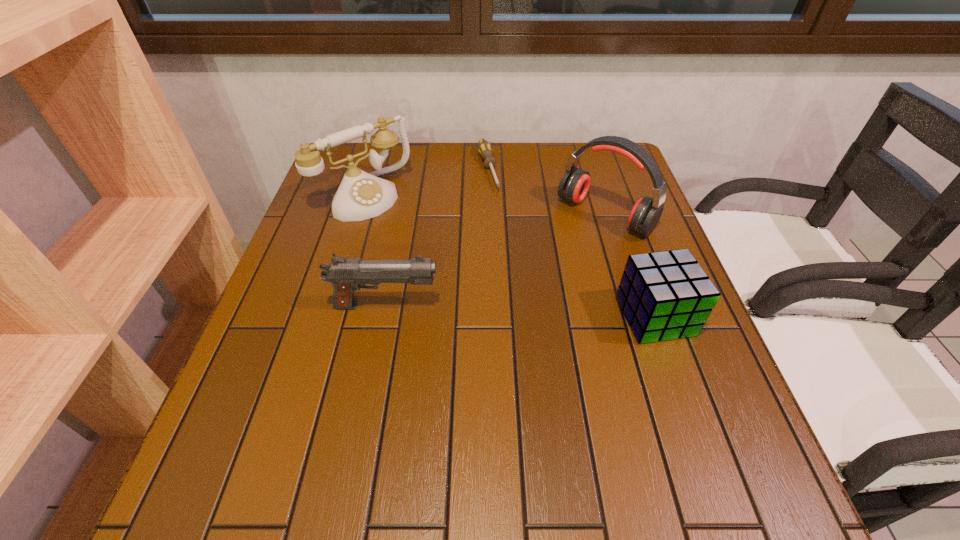
You are a GUI agent. You are given a task and a screenshot of the screen. Output one action in this format:
    pyautogui.click(x=<x>, y=<y>)
    Task: Click on the free spot on the desktop that is between the gun and the cube and is positioned on the dial of the telephone
    The height and width of the screenshot is (540, 960).
    Given the screenshot: What is the action you would take?
    pyautogui.click(x=487, y=309)

The height and width of the screenshot is (540, 960). In order to click on vacant space on the desktop that is between the gun and the cube and is positioned on the ear cups of the earphone in this screenshot , I will do `click(503, 310)`.

What are the coordinates of `vacant space on the desktop that is between the gun and the cube and is positioned at the tip of the third object from right to left` in the screenshot? It's located at (538, 312).